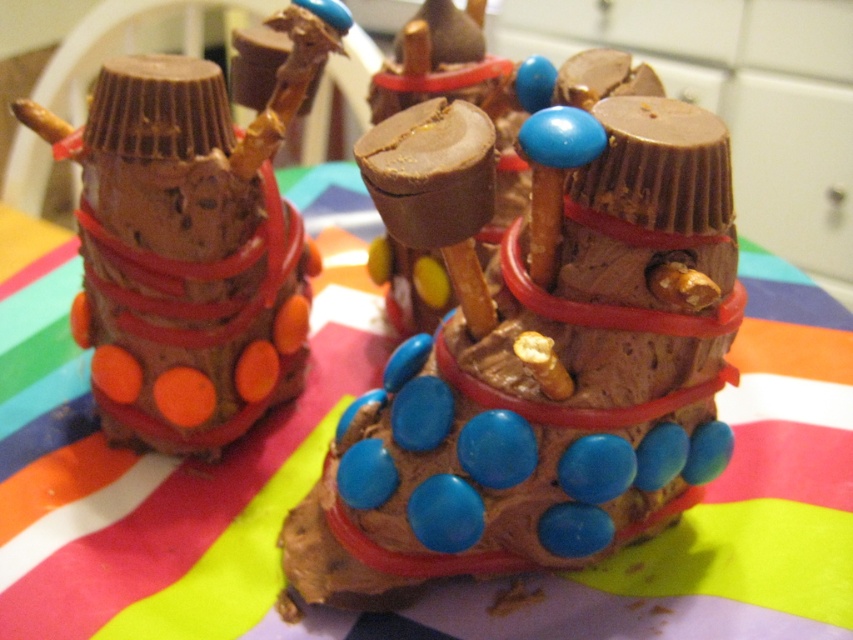
Question: Does multicolored fabric at center appear under matte chocolate candy at left?

Choices:
 (A) yes
 (B) no

Answer: (A)

Question: Does blue chocolate candy at center have a lesser width compared to matte chocolate candy at left?

Choices:
 (A) no
 (B) yes

Answer: (A)

Question: Estimate the real-world distances between objects in this image. Which object is farther from the multicolored fabric at center?

Choices:
 (A) blue chocolate candy at center
 (B) matte chocolate candy at left

Answer: (B)

Question: Is the position of multicolored fabric at center more distant than that of matte chocolate candy at left?

Choices:
 (A) no
 (B) yes

Answer: (A)

Question: Which object is closer to the camera taking this photo?

Choices:
 (A) multicolored fabric at center
 (B) matte chocolate candy at left
 (C) blue chocolate candy at center

Answer: (C)

Question: Which of the following is the closest to the observer?

Choices:
 (A) (125, 353)
 (B) (548, 632)
 (C) (335, 596)

Answer: (B)